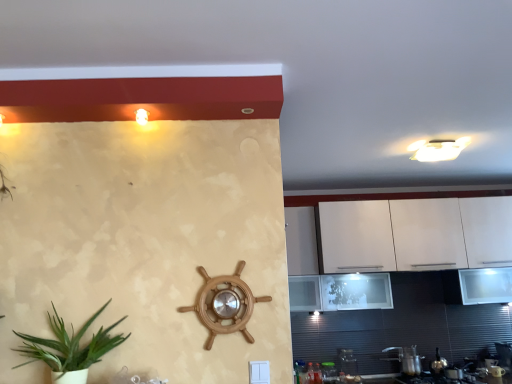
Question: Is metallic silver gas stove at lower right located outside transparent glass jar at lower right, which is the 1th appliance in left-to-right order?

Choices:
 (A) yes
 (B) no

Answer: (A)

Question: From a real-world perspective, is metallic silver gas stove at lower right physically below transparent glass jar at lower right, which is the 1th appliance in left-to-right order?

Choices:
 (A) no
 (B) yes

Answer: (B)

Question: Is metallic silver gas stove at lower right at the right side of transparent glass jar at lower right, the third appliance when ordered from right to left?

Choices:
 (A) no
 (B) yes

Answer: (B)

Question: Is metallic silver gas stove at lower right directly adjacent to transparent glass jar at lower right, which is the 1th appliance in left-to-right order?

Choices:
 (A) yes
 (B) no

Answer: (B)

Question: From a real-world perspective, is metallic silver gas stove at lower right located higher than transparent glass jar at lower right, the third appliance when ordered from right to left?

Choices:
 (A) no
 (B) yes

Answer: (A)

Question: Looking at their shapes, would you say metallic silver gas stove at lower right is wider or thinner than matte white light fixture at upper left?

Choices:
 (A) thin
 (B) wide

Answer: (B)

Question: Is metallic silver gas stove at lower right inside the boundaries of matte white light fixture at upper left, or outside?

Choices:
 (A) inside
 (B) outside

Answer: (B)

Question: In terms of height, does metallic silver gas stove at lower right look taller or shorter compared to matte white light fixture at upper left?

Choices:
 (A) short
 (B) tall

Answer: (A)

Question: From a real-world perspective, relative to matte white light fixture at upper left, is metallic silver gas stove at lower right vertically above or below?

Choices:
 (A) below
 (B) above

Answer: (A)

Question: Considering the positions of transparent glass jar at lower right, which is the 1th appliance in left-to-right order, and metallic silver gas stove at lower right in the image, is transparent glass jar at lower right, which is the 1th appliance in left-to-right order, wider or thinner than metallic silver gas stove at lower right?

Choices:
 (A) wide
 (B) thin

Answer: (B)

Question: Is point (348, 354) positioned closer to the camera than point (458, 377)?

Choices:
 (A) farther
 (B) closer

Answer: (A)

Question: In terms of height, does transparent glass jar at lower right, which is the 1th appliance in left-to-right order, look taller or shorter compared to metallic silver gas stove at lower right?

Choices:
 (A) tall
 (B) short

Answer: (A)

Question: From a real-world perspective, is transparent glass jar at lower right, which is the 1th appliance in left-to-right order, physically located above or below metallic silver gas stove at lower right?

Choices:
 (A) below
 (B) above

Answer: (B)

Question: Considering the positions of white glossy cabinet at right and metallic silver pot at lower right, which is the second appliance from left to right, in the image, is white glossy cabinet at right wider or thinner than metallic silver pot at lower right, which is the second appliance from left to right,?

Choices:
 (A) thin
 (B) wide

Answer: (B)

Question: Is white glossy cabinet at right bigger or smaller than metallic silver pot at lower right, which is the second appliance from right to left?

Choices:
 (A) big
 (B) small

Answer: (A)